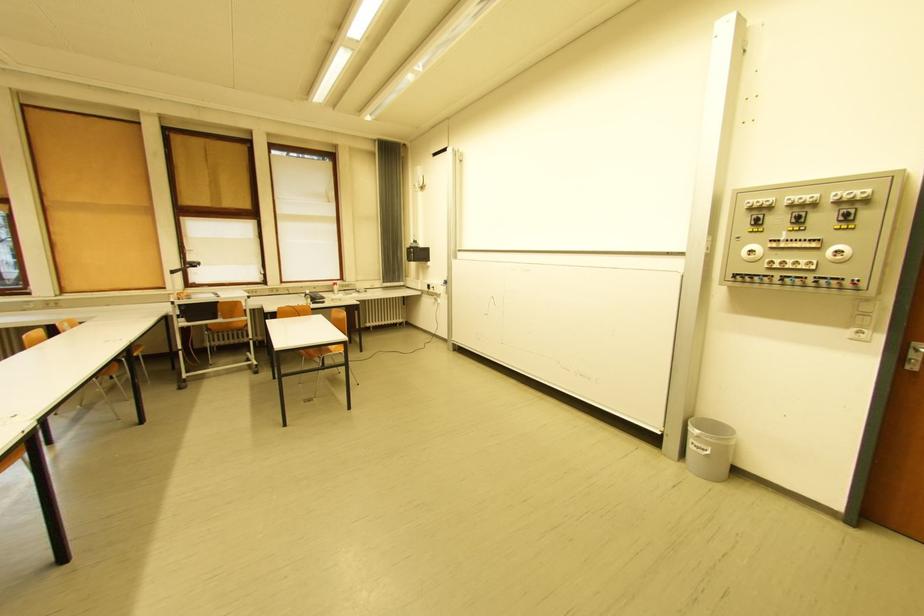
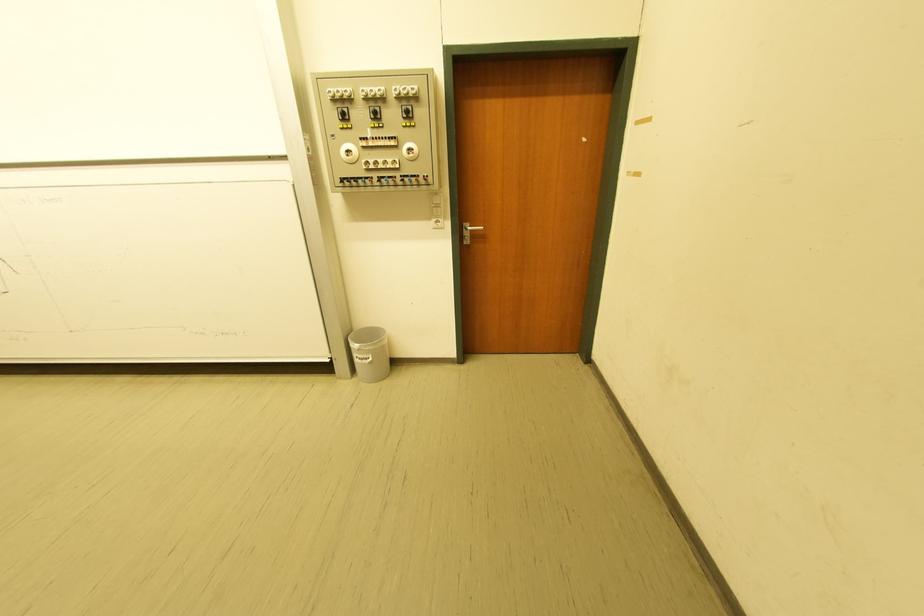
In the second image, find the point that corresponds to point 800,223 in the first image.

(380, 118)